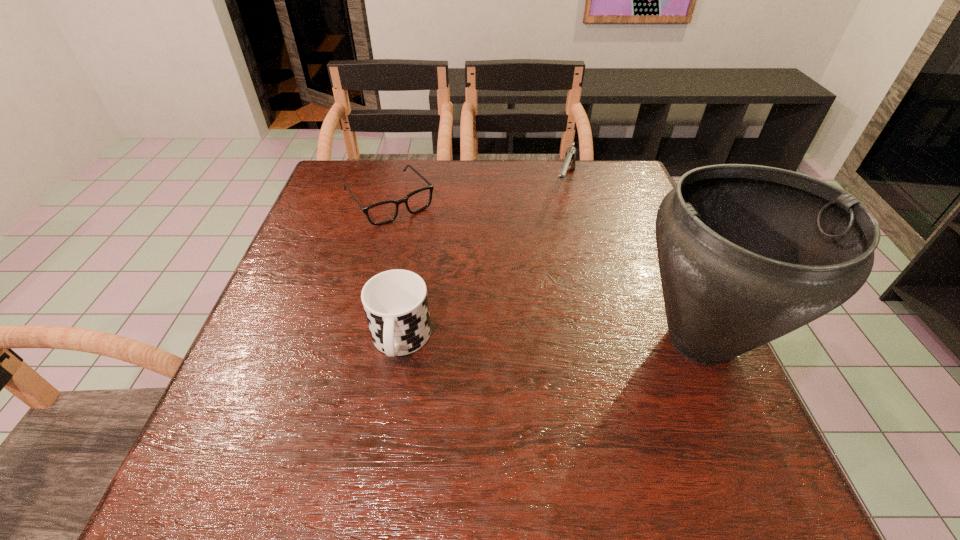
This screenshot has width=960, height=540. I want to click on vacant space in between the shortest object and the second shortest object, so click(477, 193).

Locate an element on the screen. This screenshot has width=960, height=540. free space between the gun and the cup is located at coordinates (483, 262).

At what (x,y) coordinates should I click in order to perform the action: click on empty space that is in between the gun and the spectacles. Please return your answer as a coordinate pair (x, y). The height and width of the screenshot is (540, 960). Looking at the image, I should click on (477, 193).

At what (x,y) coordinates should I click in order to perform the action: click on unoccupied position between the third tallest object and the shortest object. Please return your answer as a coordinate pair (x, y). Looking at the image, I should click on (477, 193).

This screenshot has width=960, height=540. I want to click on free space between the tallest object and the spectacles, so click(x=545, y=271).

Find the location of a particular element. object that can be found as the third closest to the shortest object is located at coordinates (747, 254).

Locate an element on the screen. Image resolution: width=960 pixels, height=540 pixels. object identified as the closest to the second shortest object is located at coordinates (747, 254).

I want to click on free spot that satisfies the following two spatial constraints: 1. on the front side of the gun; 2. on the right side of the tallest object, so click(x=605, y=341).